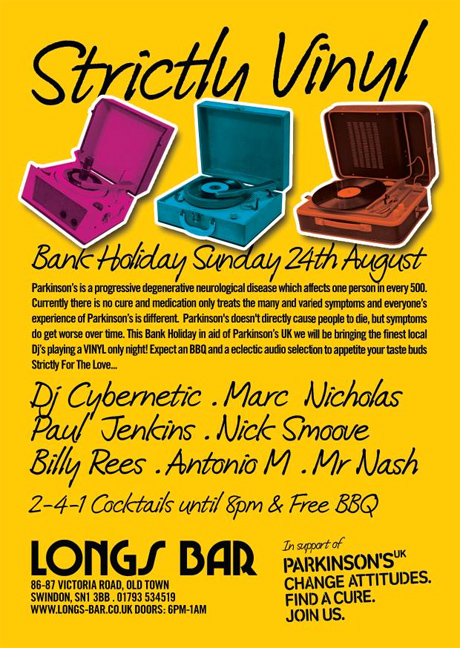
The height and width of the screenshot is (648, 460). Find the location of `orange tinted record player`. orange tinted record player is located at coordinates (302, 212).